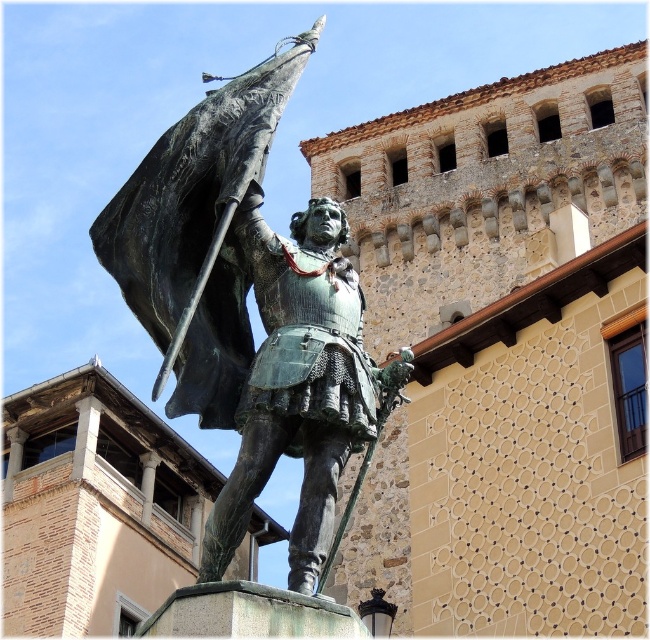
Question: Is bronze statue at center closer to the viewer compared to green patina armor at center?

Choices:
 (A) no
 (B) yes

Answer: (A)

Question: Which point is closer to the camera taking this photo?

Choices:
 (A) (339, 284)
 (B) (143, 173)

Answer: (A)

Question: Which point appears farthest from the camera in this image?

Choices:
 (A) (222, 182)
 (B) (306, 307)

Answer: (A)

Question: Which object is closer to the camera taking this photo?

Choices:
 (A) bronze statue at center
 (B) green patina armor at center

Answer: (B)

Question: Is bronze statue at center further to the viewer compared to green patina armor at center?

Choices:
 (A) no
 (B) yes

Answer: (B)

Question: Can you confirm if bronze statue at center is positioned below green patina armor at center?

Choices:
 (A) no
 (B) yes

Answer: (A)